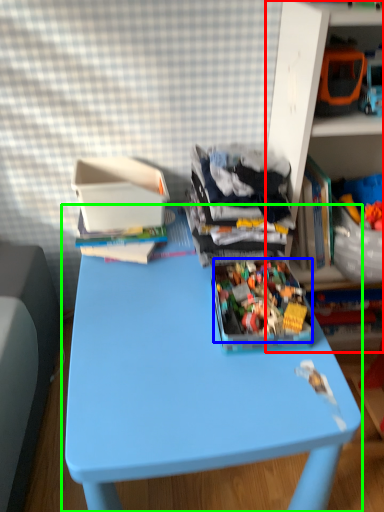
Question: Based on their relative distances, which object is farther from shelf (highlighted by a red box)? Choose from toy (highlighted by a blue box) and table (highlighted by a green box).

Choices:
 (A) toy
 (B) table

Answer: (B)